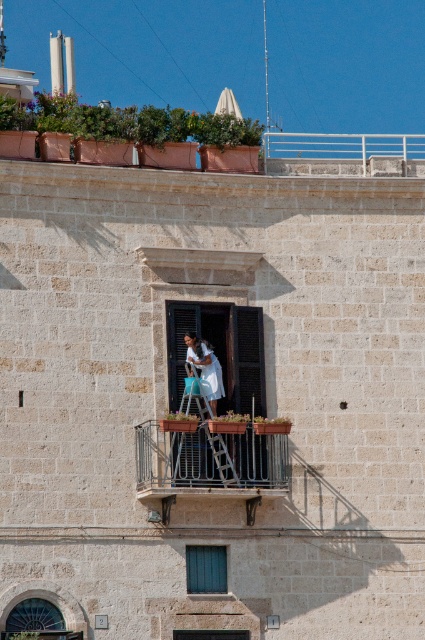
You are a painter who needs to move a metallic silver ladder at center onto the rustic wood balcony at center to paint the building. Based on the scene description, will the ladder fit on the balcony? Please explain your reasoning.

The rustic wood balcony at center has a width less than the metallic silver ladder at center. Since the ladder is wider than the balcony, it will not fit on the rustic wood balcony at center.